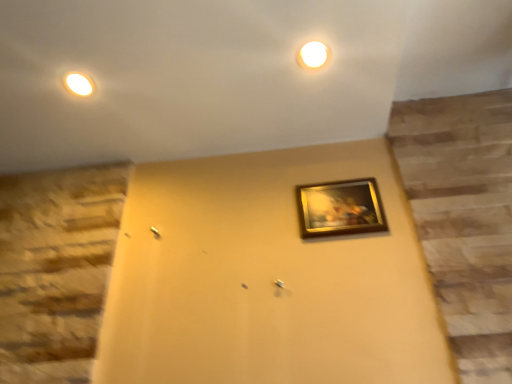
Question: Can you confirm if white glossy light at upper center is positioned to the right of gold-framed painting at center?

Choices:
 (A) no
 (B) yes

Answer: (A)

Question: Considering the relative sizes of white glossy light at upper center and gold-framed painting at center in the image provided, is white glossy light at upper center bigger than gold-framed painting at center?

Choices:
 (A) yes
 (B) no

Answer: (B)

Question: Is white glossy light at upper center smaller than gold-framed painting at center?

Choices:
 (A) yes
 (B) no

Answer: (A)

Question: Does white glossy light at upper center have a greater width compared to gold-framed painting at center?

Choices:
 (A) yes
 (B) no

Answer: (A)

Question: Considering the relative positions of white glossy light at upper center and gold-framed painting at center in the image provided, is white glossy light at upper center in front of gold-framed painting at center?

Choices:
 (A) no
 (B) yes

Answer: (B)

Question: Does white glossy light at upper center lie behind gold-framed painting at center?

Choices:
 (A) yes
 (B) no

Answer: (B)

Question: Considering the relative positions of gold-framed painting at center and white glossy light at upper center in the image provided, is gold-framed painting at center in front of white glossy light at upper center?

Choices:
 (A) yes
 (B) no

Answer: (B)

Question: From the image's perspective, does gold-framed painting at center appear higher than white glossy light at upper center?

Choices:
 (A) no
 (B) yes

Answer: (A)

Question: Is gold-framed painting at center outside of white glossy light at upper center?

Choices:
 (A) yes
 (B) no

Answer: (A)

Question: Is gold-framed painting at center bigger than white glossy light at upper center?

Choices:
 (A) yes
 (B) no

Answer: (A)

Question: From a real-world perspective, is gold-framed painting at center on white glossy light at upper center?

Choices:
 (A) yes
 (B) no

Answer: (B)

Question: Is gold-framed painting at center directly adjacent to white glossy light at upper center?

Choices:
 (A) yes
 (B) no

Answer: (B)

Question: From their relative heights in the image, would you say white glossy light at upper center is taller or shorter than gold-framed painting at center?

Choices:
 (A) short
 (B) tall

Answer: (A)